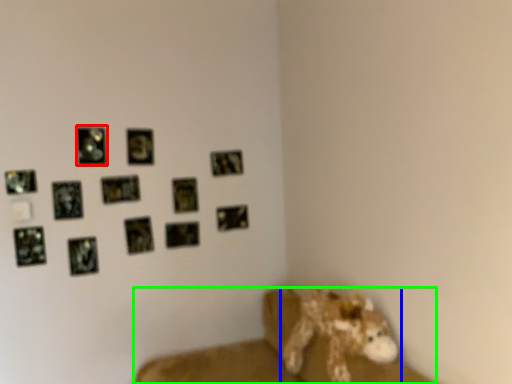
Question: Considering the real-world distances, which object is closest to picture frame (highlighted by a red box)? animal (highlighted by a blue box) or furniture (highlighted by a green box).

Choices:
 (A) animal
 (B) furniture

Answer: (B)